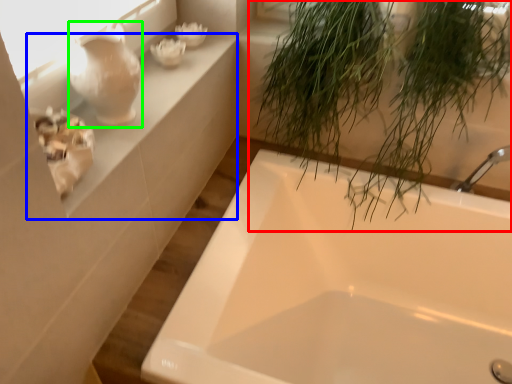
Question: Considering the real-world distances, which object is closest to houseplant (highlighted by a red box)? window sill (highlighted by a blue box) or glass vase (highlighted by a green box).

Choices:
 (A) window sill
 (B) glass vase

Answer: (A)